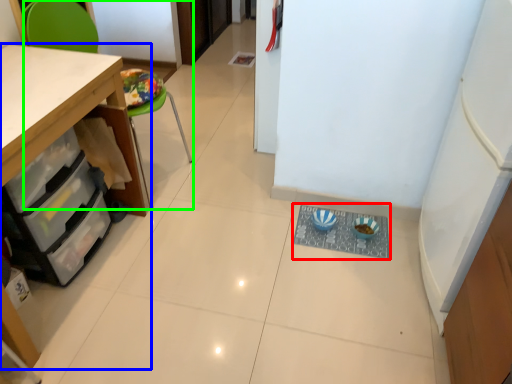
Question: Considering the real-world distances, which object is farthest from wide (highlighted by a red box)? cabinetry (highlighted by a blue box) or chair (highlighted by a green box)?

Choices:
 (A) cabinetry
 (B) chair

Answer: (B)